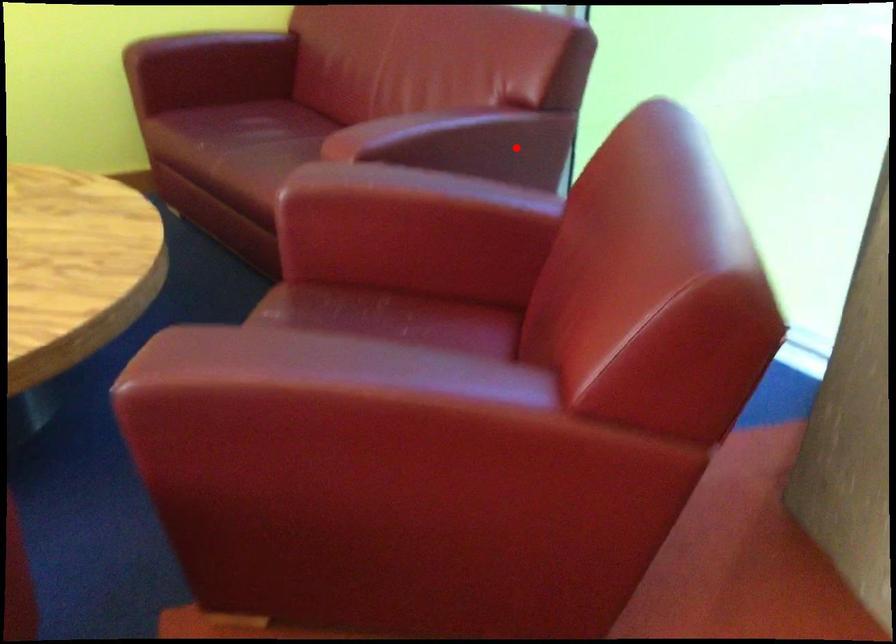
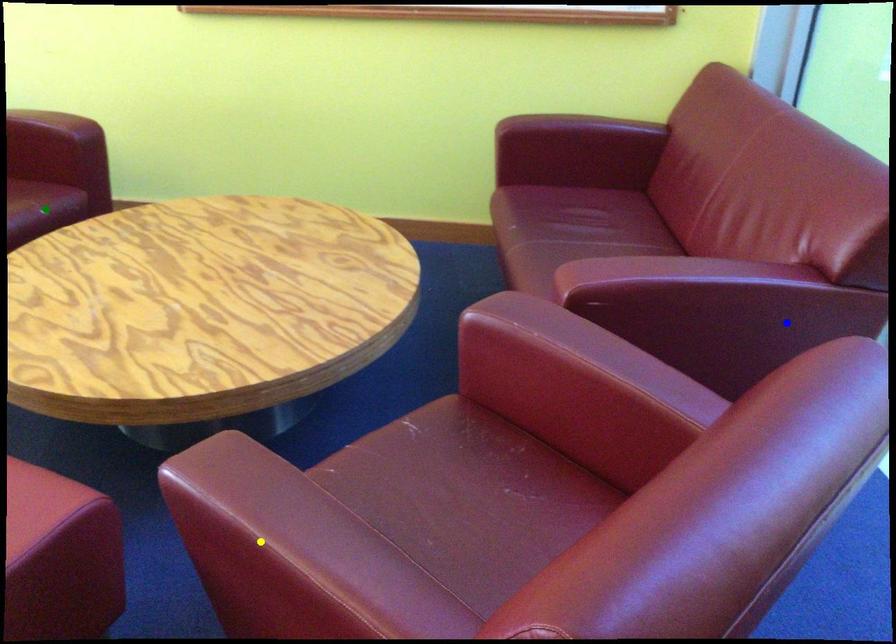
Question: I am providing you with two images of the same scene from different viewpoints. A red point is marked on the first image. You are given multiple points on the second image. Which point in image 2 represents the same 3d spot as the red point in image 1?

Choices:
 (A) blue point
 (B) green point
 (C) yellow point

Answer: (A)